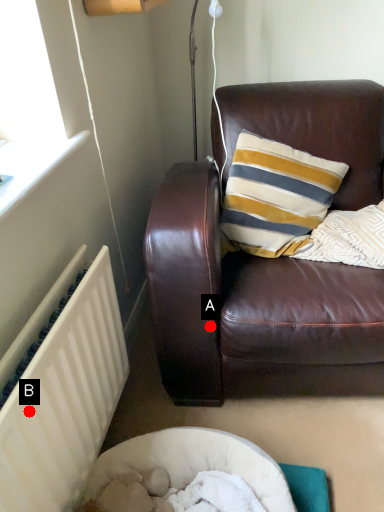
Question: Two points are circled on the image, labeled by A and B beside each circle. Which of the following is the farthest from the observer?

Choices:
 (A) A is further
 (B) B is further

Answer: (A)